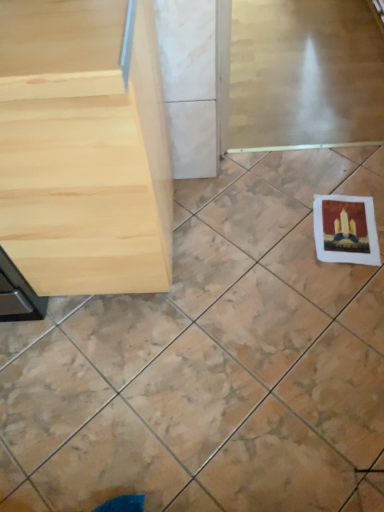
Question: Does clear glass screen door at upper center appear on the right side of matte paper postcard at lower right?

Choices:
 (A) yes
 (B) no

Answer: (A)

Question: From the image's perspective, is clear glass screen door at upper center beneath matte paper postcard at lower right?

Choices:
 (A) no
 (B) yes

Answer: (A)

Question: Is clear glass screen door at upper center completely or partially outside of matte paper postcard at lower right?

Choices:
 (A) no
 (B) yes

Answer: (B)

Question: Is the depth of clear glass screen door at upper center less than that of matte paper postcard at lower right?

Choices:
 (A) yes
 (B) no

Answer: (B)

Question: Considering the relative sizes of clear glass screen door at upper center and matte paper postcard at lower right in the image provided, is clear glass screen door at upper center wider than matte paper postcard at lower right?

Choices:
 (A) yes
 (B) no

Answer: (A)

Question: Is clear glass screen door at upper center shorter than matte paper postcard at lower right?

Choices:
 (A) no
 (B) yes

Answer: (A)

Question: Is white matte coaster at lower right surrounding clear glass screen door at upper center?

Choices:
 (A) no
 (B) yes

Answer: (A)

Question: From a real-world perspective, is white matte coaster at lower right beneath clear glass screen door at upper center?

Choices:
 (A) no
 (B) yes

Answer: (B)

Question: From the image's perspective, is white matte coaster at lower right over clear glass screen door at upper center?

Choices:
 (A) no
 (B) yes

Answer: (A)

Question: Is white matte coaster at lower right to the right of clear glass screen door at upper center from the viewer's perspective?

Choices:
 (A) yes
 (B) no

Answer: (B)

Question: Would you say white matte coaster at lower right is outside clear glass screen door at upper center?

Choices:
 (A) yes
 (B) no

Answer: (A)

Question: Is white matte coaster at lower right to the left of clear glass screen door at upper center from the viewer's perspective?

Choices:
 (A) no
 (B) yes

Answer: (B)

Question: From the image's perspective, is clear glass screen door at upper center below light wood table at left?

Choices:
 (A) yes
 (B) no

Answer: (B)